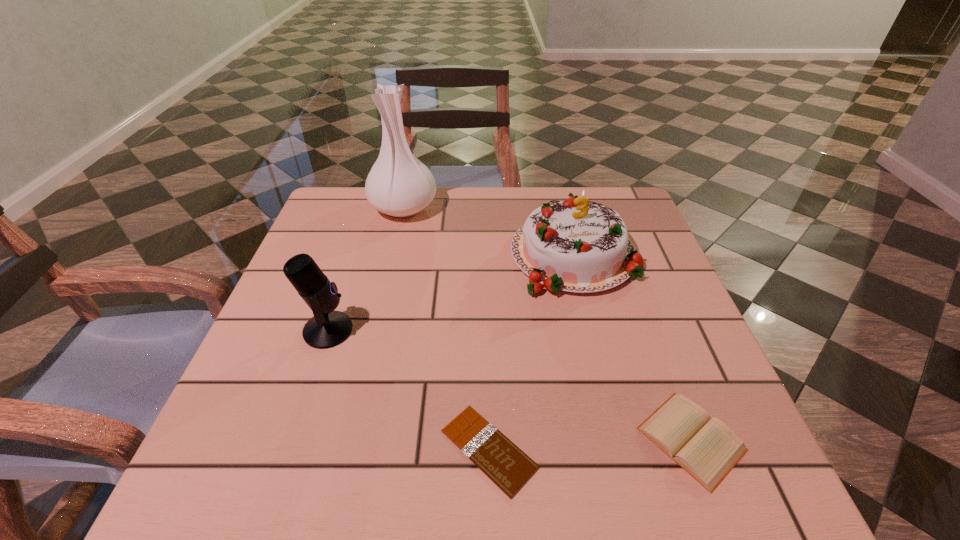
What are the coordinates of `the tallest object` in the screenshot? It's located at (400, 185).

Locate an element on the screen. the third farthest object is located at coordinates (327, 328).

Image resolution: width=960 pixels, height=540 pixels. Identify the location of cake. (573, 246).

This screenshot has width=960, height=540. I want to click on diary, so click(x=707, y=449).

Locate an element on the screen. The width and height of the screenshot is (960, 540). chocolate bar is located at coordinates click(x=506, y=465).

Where is `vacant region located on the right of the tallest object`? vacant region located on the right of the tallest object is located at coordinates (543, 207).

This screenshot has height=540, width=960. Identify the location of free space located on the stand of the microphone. (533, 330).

This screenshot has width=960, height=540. Identify the location of free region located 0.250m on the left of the cake. (405, 255).

You are a GUI agent. You are given a task and a screenshot of the screen. Output one action in this format:
    pyautogui.click(x=<x>, y=<y>)
    Task: Click on the vacant region located 0.380m on the back of the diary
    This screenshot has height=540, width=960.
    Given the screenshot: What is the action you would take?
    pyautogui.click(x=622, y=255)

This screenshot has width=960, height=540. I want to click on free space located 0.380m on the back of the chocolate bar, so pyautogui.click(x=486, y=262).